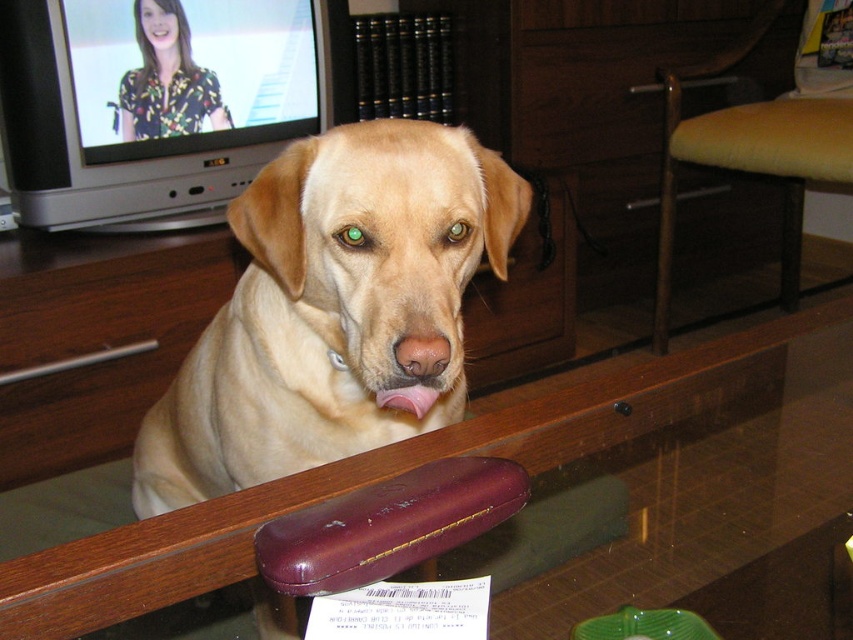
You are a dog owner who wants to place a water bowl for your Labrador Retriever. The bowl will be placed on the transparent glass table at center. Considering the dog is sitting at light brown fur at center, will the bowl be within the dog reach?

The light brown fur at center is 9.53 inches from transparent glass table at center. Since the distance is relatively short, the dog should be able to comfortably reach the bowl placed on the transparent glass table at center.

You are a guest entering the living room and want to sit down at the transparent glass table at center. The light brown fur at center belongs to the dog sitting there. Can you sit at the table without disturbing the dog?

The transparent glass table at center is behind light brown fur at center, so you can sit at the table without disturbing the dog since it is positioned behind the dog.